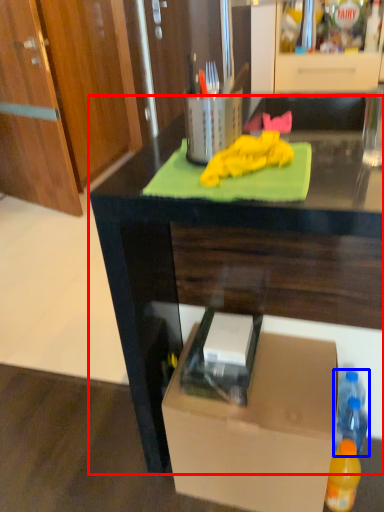
Question: Which object is further to the camera taking this photo, desk (highlighted by a red box) or bottle (highlighted by a blue box)?

Choices:
 (A) desk
 (B) bottle

Answer: (B)